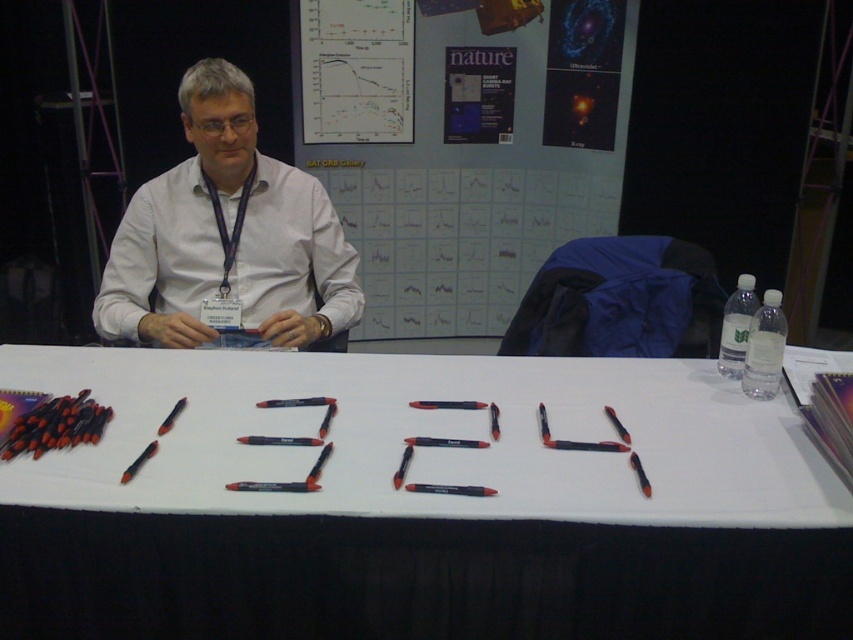
Question: Is white paper at center smaller than white matte shirt at center?

Choices:
 (A) yes
 (B) no

Answer: (B)

Question: Can you confirm if white paper at center is positioned to the right of white matte shirt at center?

Choices:
 (A) no
 (B) yes

Answer: (B)

Question: Among these points, which one is nearest to the camera?

Choices:
 (A) (524, 93)
 (B) (318, 230)

Answer: (B)

Question: Which point is farther from the camera taking this photo?

Choices:
 (A) (283, 260)
 (B) (408, 241)

Answer: (B)

Question: Which point is closer to the camera?

Choices:
 (A) matte paper poster at upper center
 (B) white paper at center
 (C) white matte shirt at center

Answer: (B)

Question: Is white paper at center wider than matte paper poster at upper center?

Choices:
 (A) no
 (B) yes

Answer: (B)